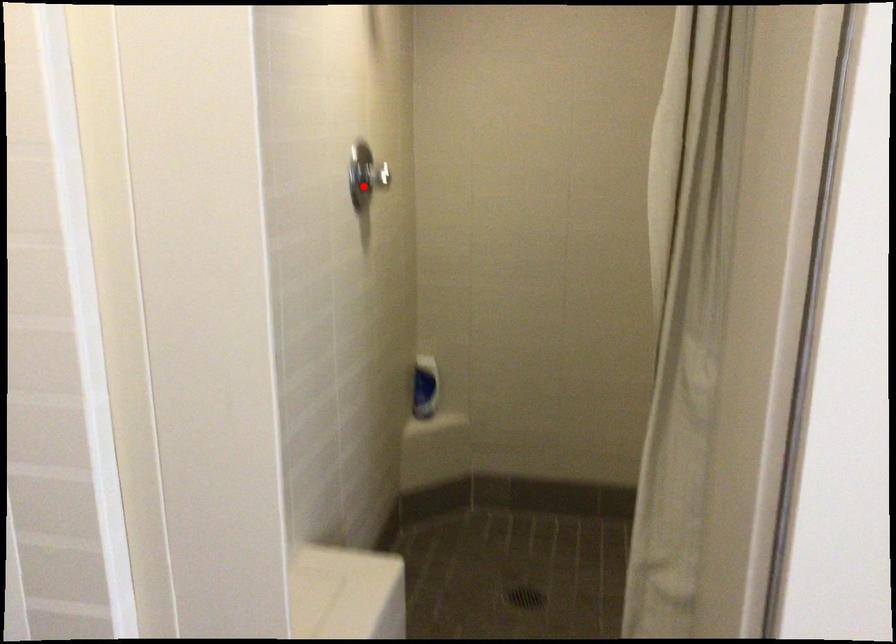
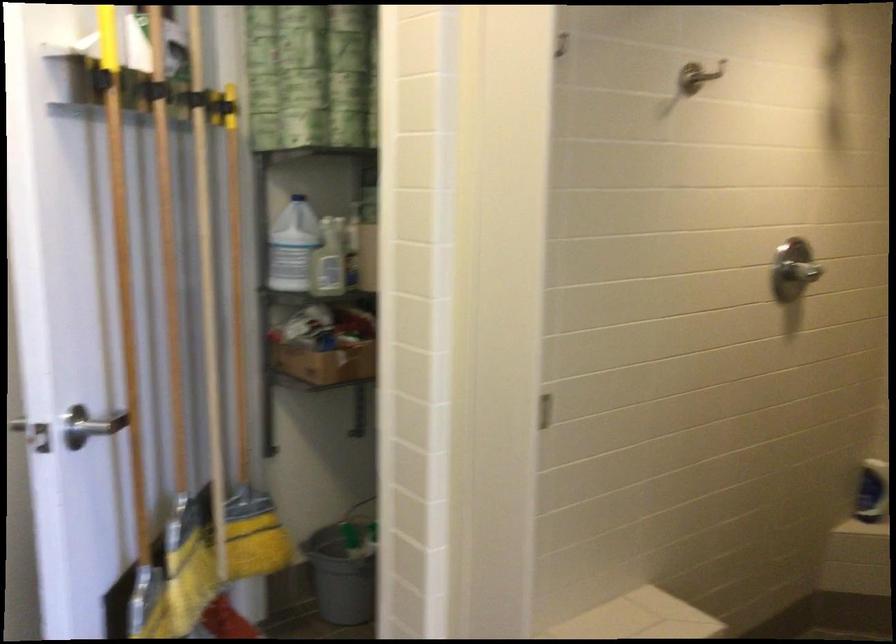
Locate, in the second image, the point that corresponds to the highlighted location in the first image.

(793, 270)